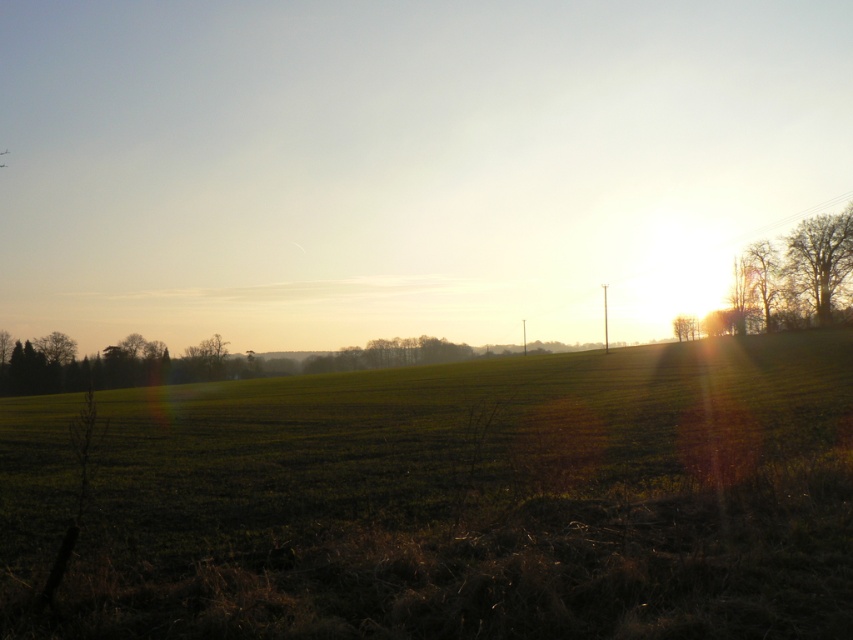
Question: Is green grass at center positioned behind bare branches at right?

Choices:
 (A) no
 (B) yes

Answer: (A)

Question: Which point is closer to the camera taking this photo?

Choices:
 (A) (440, 525)
 (B) (814, 236)

Answer: (A)

Question: Observing the image, what is the correct spatial positioning of green grass at center in reference to bare branches at right?

Choices:
 (A) below
 (B) above

Answer: (A)

Question: Does green grass at center appear over bare branches at right?

Choices:
 (A) yes
 (B) no

Answer: (B)

Question: Which point is farther to the camera?

Choices:
 (A) (48, 564)
 (B) (851, 221)

Answer: (B)